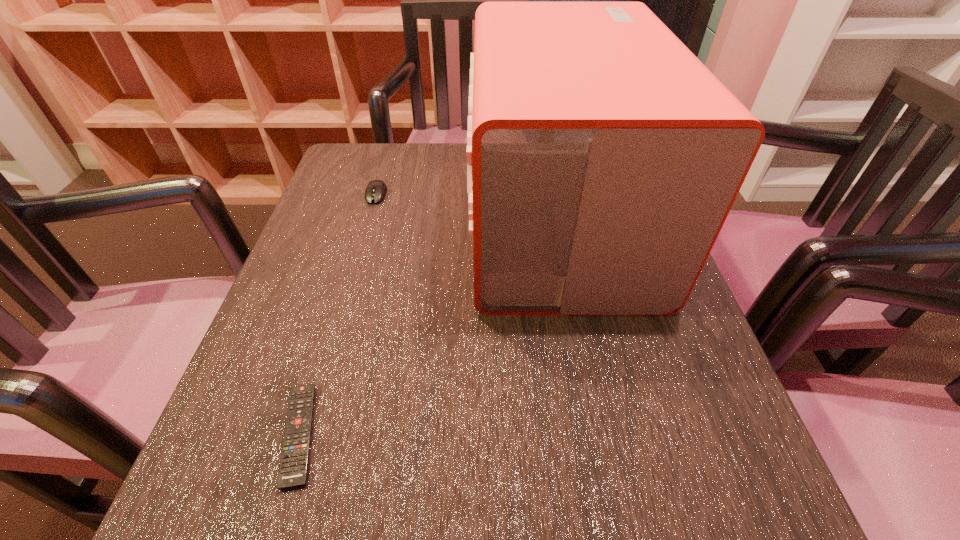
This screenshot has width=960, height=540. In order to click on vacant area that lies between the remote control and the computer mouse in this screenshot , I will do `click(338, 314)`.

Identify the location of unoccupied position between the computer mouse and the nearest object. (338, 314).

Locate an element on the screen. The height and width of the screenshot is (540, 960). vacant region between the computer mouse and the remote control is located at coordinates (338, 314).

Identify the location of vacant area that lies between the box and the nearest object. Image resolution: width=960 pixels, height=540 pixels. (428, 328).

Where is `free space between the rightmost object and the second shortest object`? The image size is (960, 540). free space between the rightmost object and the second shortest object is located at coordinates (468, 208).

Locate an element on the screen. The image size is (960, 540). vacant area that lies between the box and the remote control is located at coordinates (428, 328).

Select which object appears as the second closest to the nearest object. Please provide its 2D coordinates. Your answer should be formatted as a tuple, i.e. [(x, y)], where the tuple contains the x and y coordinates of a point satisfying the conditions above.

[(376, 190)]

The height and width of the screenshot is (540, 960). What are the coordinates of `object that ranks as the closest to the rightmost object` in the screenshot? It's located at (376, 190).